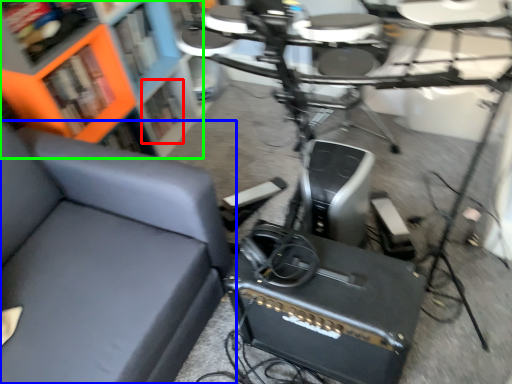
Question: Which object is the closest to the shelf (highlighted by a red box)? Choose among these: chair (highlighted by a blue box) or bookcase (highlighted by a green box).

Choices:
 (A) chair
 (B) bookcase

Answer: (B)